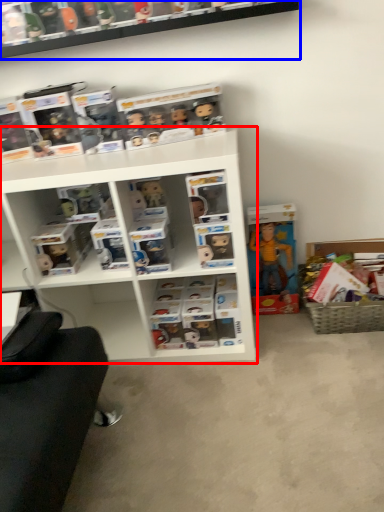
Question: Which of the following is the farthest to the observer, shelf (highlighted by a red box) or shelf (highlighted by a blue box)?

Choices:
 (A) shelf
 (B) shelf

Answer: (B)